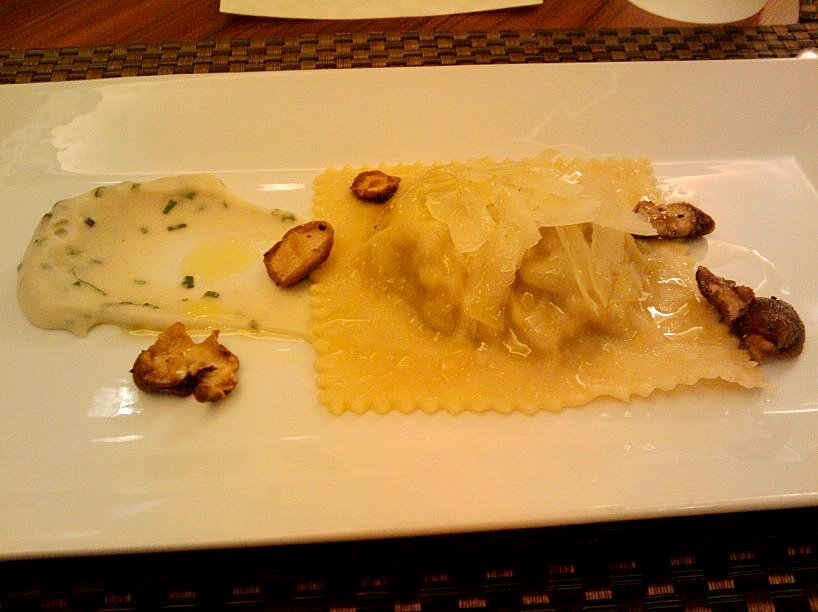
I want to click on bronze/brown woven placemat, so click(258, 53).